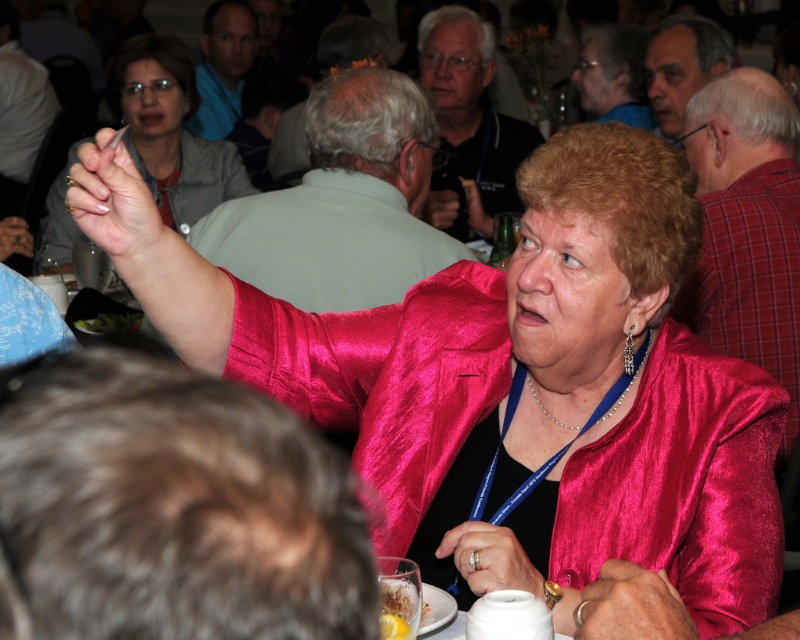
Question: Considering the real-world distances, which object is closest to the matte black hand at upper left?

Choices:
 (A) shiny pink jacket at center
 (B) yellow matte lemon at lower center
 (C) green leafy vegetable at upper left

Answer: (C)

Question: Can you confirm if shiny pink robe at center is positioned below green leafy vegetable at upper left?

Choices:
 (A) no
 (B) yes

Answer: (A)

Question: Where is shiny pink robe at center located in relation to matte black hand at upper left in the image?

Choices:
 (A) above
 (B) below

Answer: (B)

Question: Is the position of matte black hand at upper left more distant than that of yellow matte lemon at lower center?

Choices:
 (A) yes
 (B) no

Answer: (A)

Question: Which object is the farthest from the matte black hand at upper left?

Choices:
 (A) shiny pink jacket at center
 (B) yellow matte lemon at lower center
 (C) shiny pink robe at center
 (D) green leafy vegetable at upper left

Answer: (B)

Question: Estimate the real-world distances between objects in this image. Which object is closer to the shiny pink robe at center?

Choices:
 (A) shiny pink jacket at center
 (B) matte black hand at upper left
 (C) green leafy vegetable at upper left
 (D) yellow matte lemon at lower center

Answer: (C)